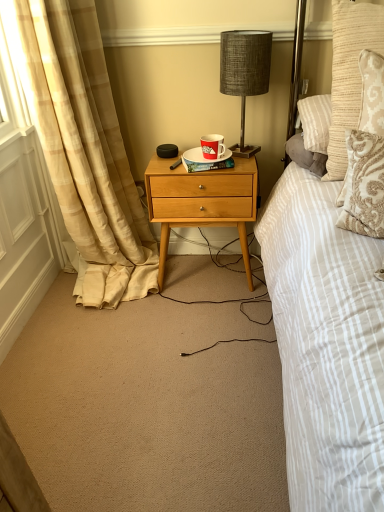
Locate an element on the screen. This screenshot has height=512, width=384. empty space that is ontop of natural wood nightstand at center (from a real-world perspective) is located at coordinates (206, 160).